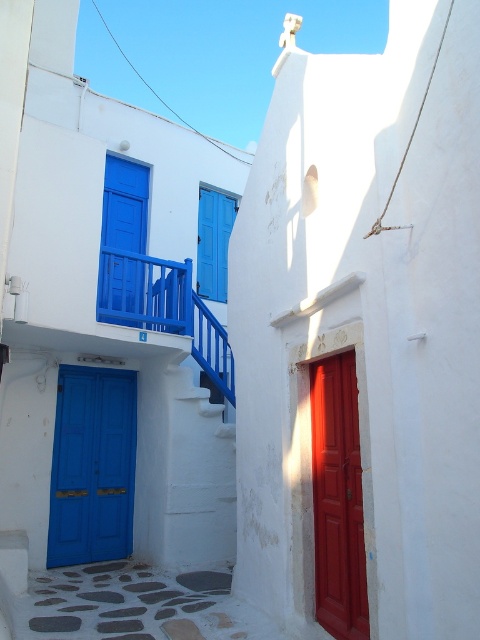
You are standing at the entrance of the alleyway and want to reach the smooth glossy wood door at right. Which direction should you walk relative to the white painted wood stairs at center?

The smooth glossy wood door at right is positioned over the white painted wood stairs at center, so you should walk towards the stairs to reach the door.

You are a tourist standing at the entrance of the alleyway and want to take a photo of the matte blue door at center without the white painted wood stairs at center blocking the view. Is this possible?

The matte blue door at center is behind the white painted wood stairs at center, so it is already blocked by the stairs. Therefore, you cannot take a photo of the matte blue door at center without the white painted wood stairs at center blocking the view.